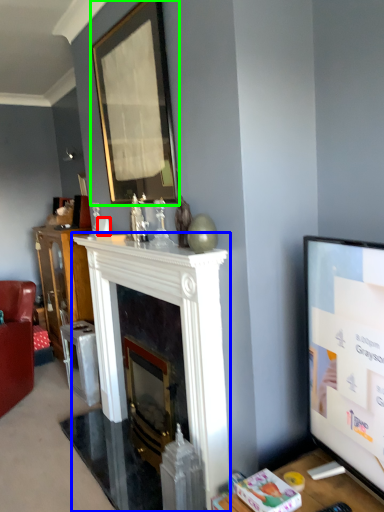
Question: Which object is the closest to the coffee cup (highlighted by a red box)? Choose among these: fireplace (highlighted by a blue box) or picture frame (highlighted by a green box).

Choices:
 (A) fireplace
 (B) picture frame

Answer: (A)